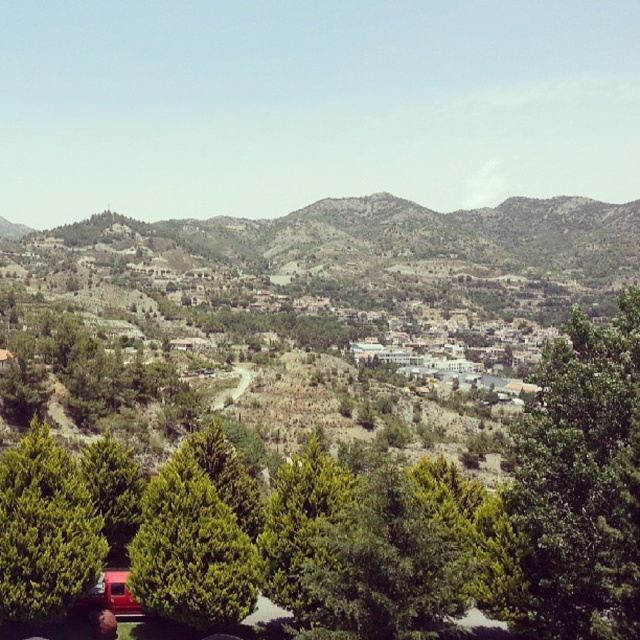
Question: Which point appears closest to the camera in this image?

Choices:
 (A) (218, 356)
 (B) (161, 579)
 (C) (600, 442)
 (D) (72, 547)

Answer: (C)

Question: Among these points, which one is farthest from the camera?

Choices:
 (A) click(x=96, y=516)
 (B) click(x=340, y=330)
 (C) click(x=509, y=582)

Answer: (B)

Question: Can you confirm if green leafy tree at lower left is wider than green textured tree at lower left?

Choices:
 (A) yes
 (B) no

Answer: (B)

Question: Is green textured hillside at center further to the viewer compared to green leafy tree at lower left?

Choices:
 (A) yes
 (B) no

Answer: (A)

Question: Which of the following is the farthest from the observer?

Choices:
 (A) (282, 380)
 (B) (172, 572)

Answer: (A)

Question: Does green textured hillside at center lie behind green leafy tree at center?

Choices:
 (A) no
 (B) yes

Answer: (B)